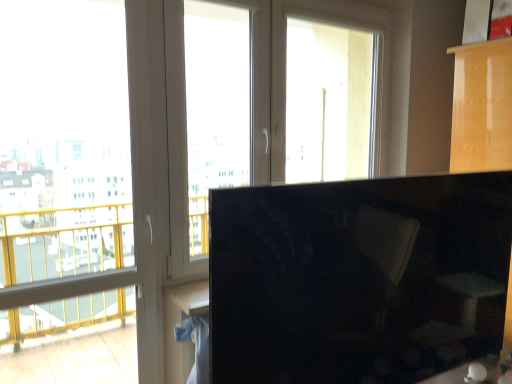
Question: From the image's perspective, would you say black glossy monitor at right is shown under transparent glass window at center, acting as the second window screen starting from the left?

Choices:
 (A) no
 (B) yes

Answer: (B)

Question: Does black glossy monitor at right come behind transparent glass window at center, the second window screen when ordered from right to left?

Choices:
 (A) yes
 (B) no

Answer: (B)

Question: Is black glossy monitor at right not close to transparent glass window at center, the second window screen when ordered from right to left?

Choices:
 (A) yes
 (B) no

Answer: (A)

Question: Is black glossy monitor at right smaller than transparent glass window at center, the second window screen when ordered from right to left?

Choices:
 (A) yes
 (B) no

Answer: (B)

Question: Is black glossy monitor at right bigger than transparent glass window at center, acting as the second window screen starting from the left?

Choices:
 (A) yes
 (B) no

Answer: (A)

Question: Can you confirm if black glossy monitor at right is shorter than transparent glass window at center, acting as the second window screen starting from the left?

Choices:
 (A) yes
 (B) no

Answer: (A)

Question: Does transparent glass window at center, acting as the second window screen starting from the left, appear on the left side of black glossy monitor at right?

Choices:
 (A) yes
 (B) no

Answer: (A)

Question: Is transparent glass window at center, acting as the second window screen starting from the left, outside black glossy monitor at right?

Choices:
 (A) no
 (B) yes

Answer: (B)

Question: Does transparent glass window at center, acting as the second window screen starting from the left, have a lesser width compared to black glossy monitor at right?

Choices:
 (A) no
 (B) yes

Answer: (B)

Question: Considering the relative positions of transparent glass window at center, the second window screen when ordered from right to left, and black glossy monitor at right in the image provided, is transparent glass window at center, the second window screen when ordered from right to left, in front of black glossy monitor at right?

Choices:
 (A) yes
 (B) no

Answer: (B)

Question: Can you confirm if transparent glass window at center, the second window screen when ordered from right to left, is smaller than black glossy monitor at right?

Choices:
 (A) yes
 (B) no

Answer: (A)

Question: Considering the relative sizes of transparent glass window at center, the second window screen when ordered from right to left, and black glossy monitor at right in the image provided, is transparent glass window at center, the second window screen when ordered from right to left, bigger than black glossy monitor at right?

Choices:
 (A) no
 (B) yes

Answer: (A)

Question: Is transparent glass window at center, the second window screen when ordered from right to left, located within transparent glass window at left, the third window screen viewed from the right?

Choices:
 (A) yes
 (B) no

Answer: (B)